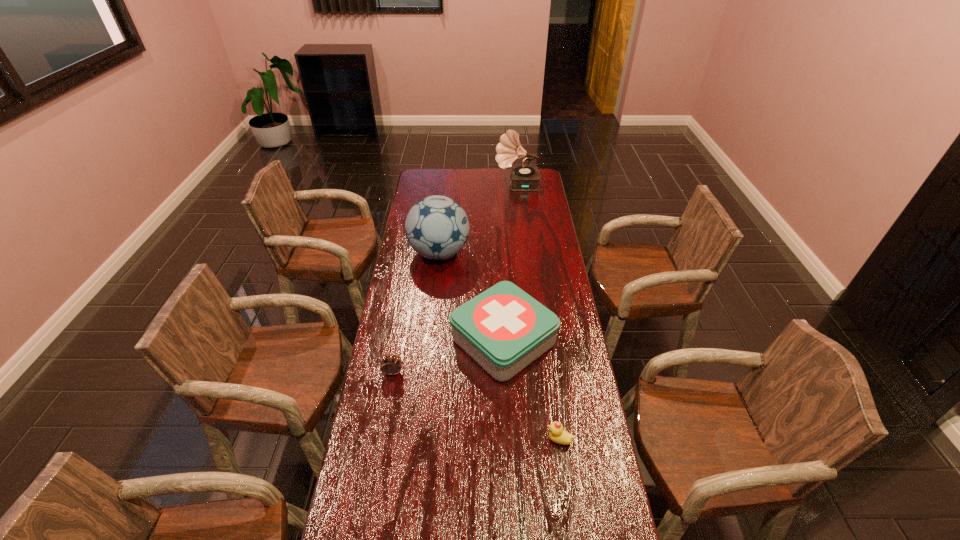
Locate an element on the screen. the first-aid kit positioned at the right edge is located at coordinates pos(504,329).

Locate an element on the screen. The image size is (960, 540). duckling that is at the right edge is located at coordinates (557, 434).

Where is `object that is at the far right corner`? Image resolution: width=960 pixels, height=540 pixels. object that is at the far right corner is located at coordinates (523, 177).

The image size is (960, 540). I want to click on free space at the far edge of the desktop, so click(x=483, y=173).

Where is `vacant space at the left edge of the desktop`? Image resolution: width=960 pixels, height=540 pixels. vacant space at the left edge of the desktop is located at coordinates (356, 454).

In the image, there is a desktop. Where is `free space at the right edge`? This screenshot has width=960, height=540. free space at the right edge is located at coordinates (532, 252).

At what (x,y) coordinates should I click in order to perform the action: click on vacant space at the far left corner of the desktop. Please return your answer as a coordinate pair (x, y). The height and width of the screenshot is (540, 960). Looking at the image, I should click on (423, 171).

The width and height of the screenshot is (960, 540). I want to click on free point between the second shortest object and the soccer ball, so click(416, 313).

The image size is (960, 540). Find the location of `free spot between the soccer ball and the first-aid kit`. free spot between the soccer ball and the first-aid kit is located at coordinates (471, 297).

In order to click on vacant region between the fourth nearest object and the farthest object in this screenshot , I will do `click(478, 219)`.